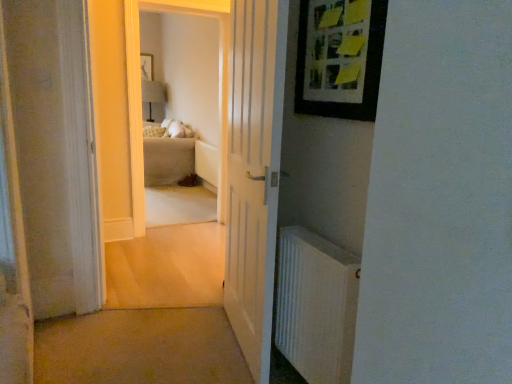
Question: Is carpet at center taller than matte black picture frame at upper center, which appears as the 1th picture frame when viewed from the top?

Choices:
 (A) yes
 (B) no

Answer: (B)

Question: Is carpet at center further to camera compared to matte black picture frame at upper center, which ranks as the first picture frame in left-to-right order?

Choices:
 (A) no
 (B) yes

Answer: (A)

Question: Considering the relative sizes of carpet at center and matte black picture frame at upper center, placed as the second picture frame when sorted from bottom to top, in the image provided, is carpet at center smaller than matte black picture frame at upper center, placed as the second picture frame when sorted from bottom to top,?

Choices:
 (A) yes
 (B) no

Answer: (B)

Question: Is there a large distance between carpet at center and matte black picture frame at upper center, which appears as the 1th picture frame when viewed from the back?

Choices:
 (A) yes
 (B) no

Answer: (A)

Question: Considering the relative positions of carpet at center and matte black picture frame at upper center, which appears as the 1th picture frame when viewed from the top, in the image provided, is carpet at center to the left of matte black picture frame at upper center, which appears as the 1th picture frame when viewed from the top, from the viewer's perspective?

Choices:
 (A) no
 (B) yes

Answer: (A)

Question: Is beige fabric couch at center taller or shorter than matte white lampshade at upper center?

Choices:
 (A) short
 (B) tall

Answer: (B)

Question: Based on their positions, is beige fabric couch at center located to the left or right of matte white lampshade at upper center?

Choices:
 (A) right
 (B) left

Answer: (A)

Question: Is beige fabric couch at center situated inside matte white lampshade at upper center or outside?

Choices:
 (A) outside
 (B) inside

Answer: (A)

Question: Looking at their shapes, would you say beige fabric couch at center is wider or thinner than matte white lampshade at upper center?

Choices:
 (A) wide
 (B) thin

Answer: (A)

Question: Choose the correct answer: Is matte white lampshade at upper center inside white plastic radiator at right or outside it?

Choices:
 (A) outside
 (B) inside

Answer: (A)

Question: Is matte white lampshade at upper center taller or shorter than white plastic radiator at right?

Choices:
 (A) tall
 (B) short

Answer: (A)

Question: In terms of size, does matte white lampshade at upper center appear bigger or smaller than white plastic radiator at right?

Choices:
 (A) big
 (B) small

Answer: (A)

Question: From a real-world perspective, is matte white lampshade at upper center positioned above or below white plastic radiator at right?

Choices:
 (A) below
 (B) above

Answer: (B)

Question: Looking at their shapes, would you say matte black picture frame at upper center, positioned as the 2th picture frame in front-to-back order, is wider or thinner than carpet at center?

Choices:
 (A) thin
 (B) wide

Answer: (A)

Question: Based on their sizes in the image, would you say matte black picture frame at upper center, which appears as the 1th picture frame when viewed from the top, is bigger or smaller than carpet at center?

Choices:
 (A) small
 (B) big

Answer: (A)